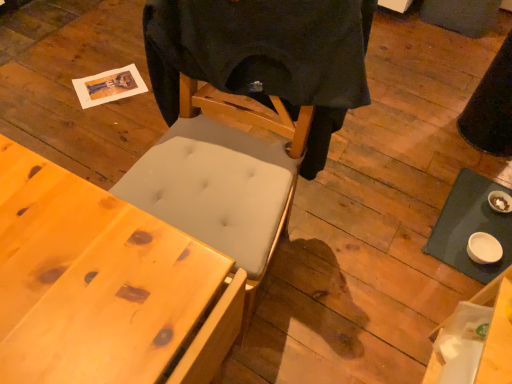
Question: Is black matte t-shirt at center facing away from white matte table at lower right?

Choices:
 (A) no
 (B) yes

Answer: (A)

Question: Can you confirm if black matte t-shirt at center is shorter than white matte table at lower right?

Choices:
 (A) yes
 (B) no

Answer: (B)

Question: Is black matte t-shirt at center placed right next to white matte table at lower right?

Choices:
 (A) no
 (B) yes

Answer: (A)

Question: From the image's perspective, is black matte t-shirt at center above white matte table at lower right?

Choices:
 (A) no
 (B) yes

Answer: (B)

Question: Is black matte t-shirt at center at the right side of white matte table at lower right?

Choices:
 (A) no
 (B) yes

Answer: (A)

Question: Does point (26, 251) appear closer or farther from the camera than point (275, 77)?

Choices:
 (A) farther
 (B) closer

Answer: (B)

Question: Looking at the image, does wooden desk at lower left seem bigger or smaller compared to black matte t-shirt at center?

Choices:
 (A) big
 (B) small

Answer: (A)

Question: Is wooden desk at lower left to the left or to the right of black matte t-shirt at center in the image?

Choices:
 (A) right
 (B) left

Answer: (B)

Question: Looking at their shapes, would you say wooden desk at lower left is wider or thinner than black matte t-shirt at center?

Choices:
 (A) thin
 (B) wide

Answer: (B)

Question: From a real-world perspective, is white matte table at lower right above or below wooden desk at lower left?

Choices:
 (A) below
 (B) above

Answer: (A)

Question: Is white matte table at lower right inside or outside of wooden desk at lower left?

Choices:
 (A) inside
 (B) outside

Answer: (B)

Question: Considering the positions of point (479, 203) and point (94, 337), is point (479, 203) closer or farther from the camera than point (94, 337)?

Choices:
 (A) closer
 (B) farther

Answer: (B)

Question: In terms of height, does white matte table at lower right look taller or shorter compared to wooden desk at lower left?

Choices:
 (A) tall
 (B) short

Answer: (B)

Question: Is white matte table at lower right in front of or behind black matte t-shirt at center in the image?

Choices:
 (A) behind
 (B) front

Answer: (A)

Question: From a real-world perspective, is white matte table at lower right above or below black matte t-shirt at center?

Choices:
 (A) above
 (B) below

Answer: (B)